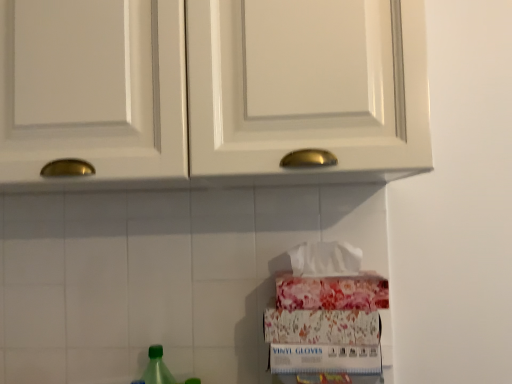
Question: From a real-world perspective, is green matte bottle at lower left positioned over white glossy cabinet doors at upper center based on gravity?

Choices:
 (A) no
 (B) yes

Answer: (A)

Question: Does green matte bottle at lower left have a greater width compared to white glossy cabinet doors at upper center?

Choices:
 (A) no
 (B) yes

Answer: (A)

Question: Does green matte bottle at lower left have a larger size compared to white glossy cabinet doors at upper center?

Choices:
 (A) no
 (B) yes

Answer: (A)

Question: Is white glossy cabinet doors at upper center inside green matte bottle at lower left?

Choices:
 (A) yes
 (B) no

Answer: (B)

Question: From the image's perspective, would you say green matte bottle at lower left is positioned over white glossy cabinet doors at upper center?

Choices:
 (A) yes
 (B) no

Answer: (B)

Question: Is green matte bottle at lower left at the right side of white glossy cabinet doors at upper center?

Choices:
 (A) yes
 (B) no

Answer: (B)

Question: Is white glossy cabinet doors at upper center outside green matte bottle at lower left?

Choices:
 (A) no
 (B) yes

Answer: (B)

Question: Is white glossy cabinet doors at upper center at the right side of green matte bottle at lower left?

Choices:
 (A) yes
 (B) no

Answer: (A)

Question: Is white glossy cabinet doors at upper center directly adjacent to green matte bottle at lower left?

Choices:
 (A) no
 (B) yes

Answer: (A)

Question: From a real-world perspective, is white glossy cabinet doors at upper center physically above green matte bottle at lower left?

Choices:
 (A) yes
 (B) no

Answer: (A)

Question: Can you confirm if white glossy cabinet doors at upper center is bigger than green matte bottle at lower left?

Choices:
 (A) yes
 (B) no

Answer: (A)

Question: Is white glossy cabinet doors at upper center positioned before green matte bottle at lower left?

Choices:
 (A) yes
 (B) no

Answer: (A)

Question: In the image, is white glossy cabinet doors at upper center on the left side or the right side of green matte bottle at lower left?

Choices:
 (A) left
 (B) right

Answer: (B)